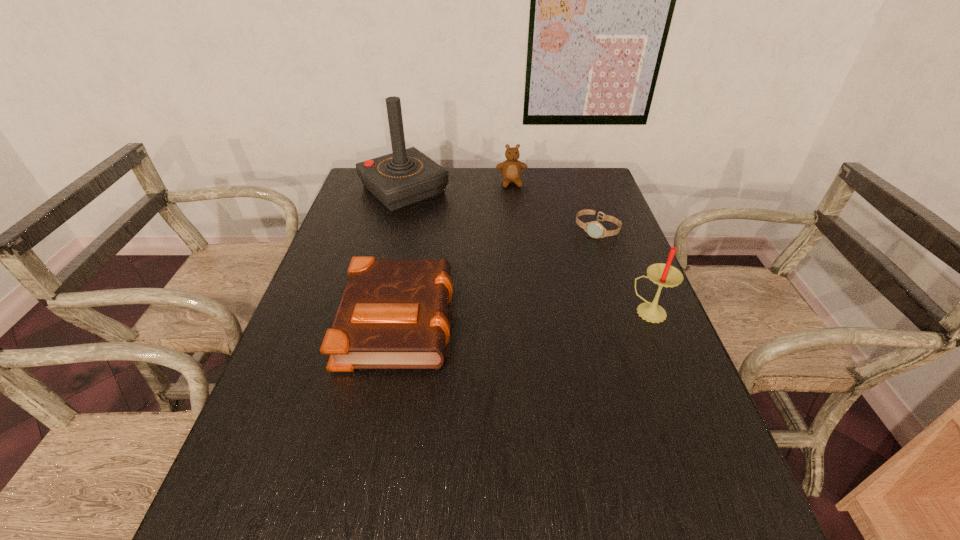
Image resolution: width=960 pixels, height=540 pixels. What are the coordinates of `Bible` in the screenshot? It's located at (393, 313).

Find the location of `candle`. candle is located at coordinates (665, 275).

Find the location of a particular element. Image resolution: width=960 pixels, height=540 pixels. the third shortest object is located at coordinates pyautogui.click(x=511, y=169).

This screenshot has width=960, height=540. I want to click on teddy bear, so point(511,169).

Where is `the third farthest object`? the third farthest object is located at coordinates (x=594, y=229).

Locate an element on the screen. This screenshot has height=540, width=960. the shortest object is located at coordinates (594, 229).

Where is `the tallest object`? The height and width of the screenshot is (540, 960). the tallest object is located at coordinates (405, 177).

What are the coordinates of `vacant space situated 0.260m on the spine side of the fourth tallest object` in the screenshot? It's located at (558, 318).

Image resolution: width=960 pixels, height=540 pixels. In order to click on vacant space located on the back of the candle in this screenshot , I will do `click(628, 260)`.

The image size is (960, 540). I want to click on blank space located 0.250m on the front-facing side of the third shortest object, so click(x=521, y=230).